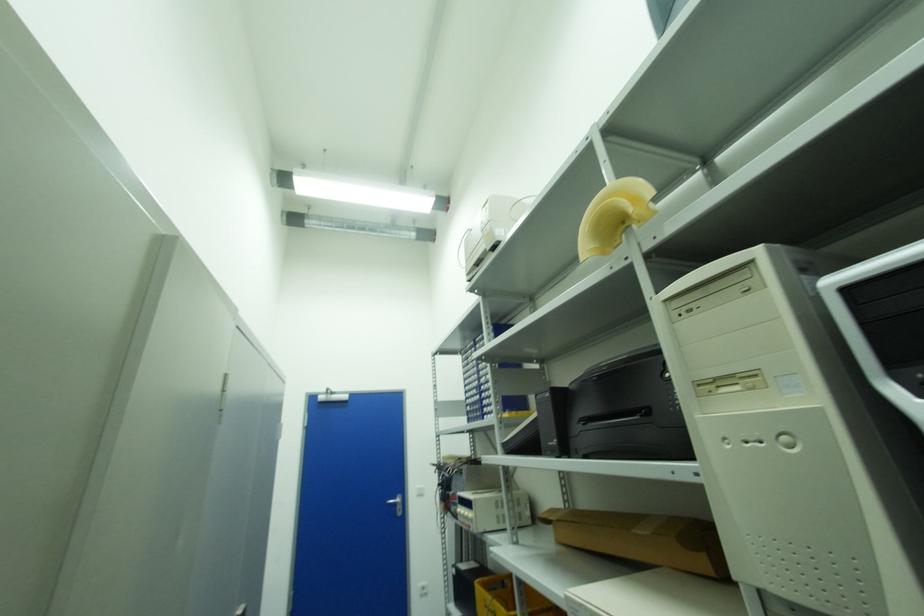
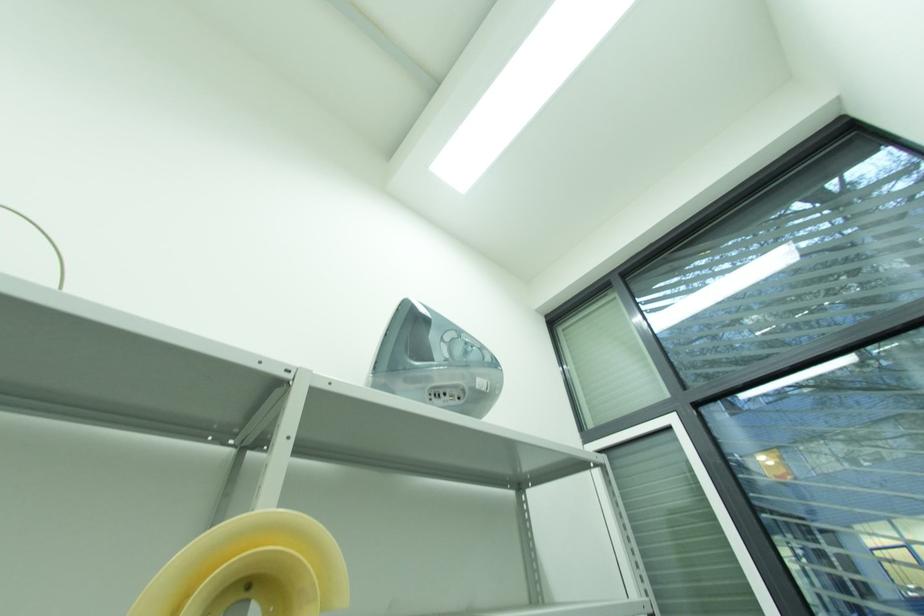
First-person continuous shooting, in which direction is the camera rotating?

The camera rotated toward right-up.